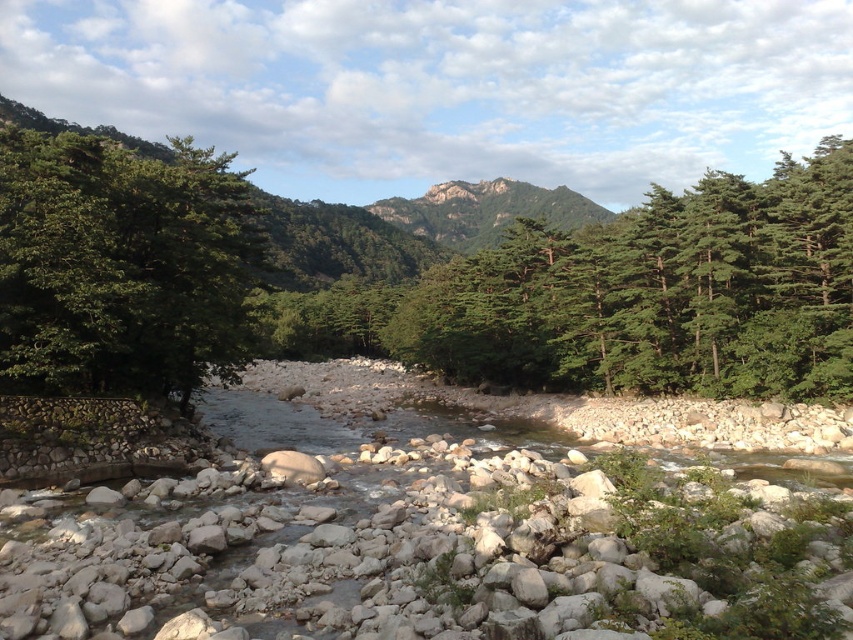
Which object is larger in the scene, the green leafy tree at left or the rugged stone mountain at center?

The rugged stone mountain at center is larger than the green leafy tree at left.

Looking at this image, you are standing at the origin point in the image. The green textured trees at center are located at coordinates 0.464, 0.735. If you want to walk towards them, which direction should you move in?

The green textured trees at center are located at coordinates (x=625, y=296), so you should move in the direction of the center of the image to reach them.

A hiker wants to take a photo of the green textured trees at center from a safe distance. The camera has a maximum zoom range of 50 meters. Can the hiker capture the trees without moving closer?

The green textured trees at center are 36.73 meters away from the viewer. Since the camera can zoom up to 50 meters, the hiker can capture the trees without moving closer.